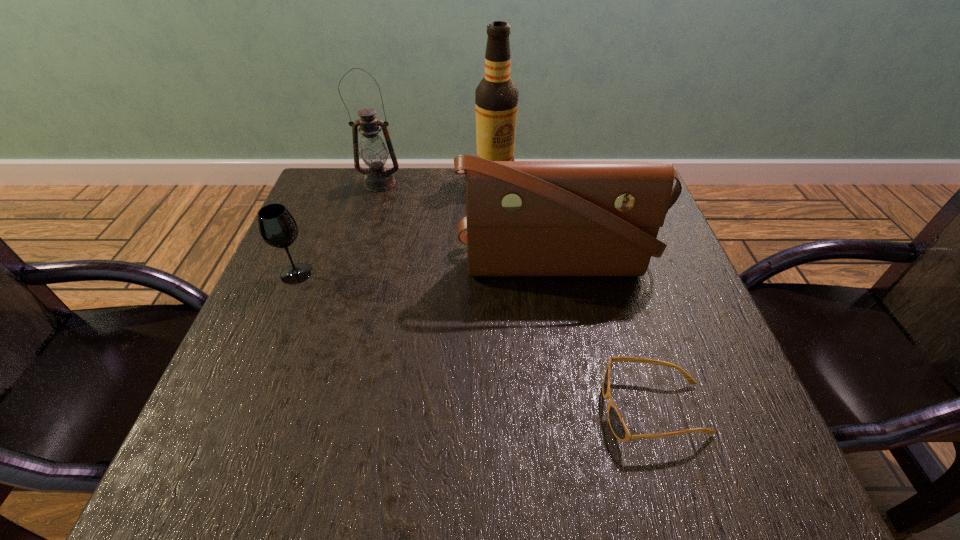
You are a GUI agent. You are given a task and a screenshot of the screen. Output one action in this format:
    pyautogui.click(x=<x>, y=<y>)
    Task: Click on the vacant area that lies between the shortest object and the alcohol
    
    Given the screenshot: What is the action you would take?
    pyautogui.click(x=574, y=293)

Locate an element on the screen. This screenshot has height=540, width=960. blank region between the satchel and the nearest object is located at coordinates (605, 337).

Locate an element on the screen. free spot between the nearest object and the alcohol is located at coordinates (574, 293).

The height and width of the screenshot is (540, 960). Identify the location of blank region between the fourth tallest object and the satchel. (425, 269).

This screenshot has height=540, width=960. What are the coordinates of `empty space between the satchel and the second shortest object` in the screenshot? It's located at (425, 269).

You are a GUI agent. You are given a task and a screenshot of the screen. Output one action in this format:
    pyautogui.click(x=<x>, y=<y>)
    Task: Click on the empty space that is in between the second shortest object and the alcohol
    
    Given the screenshot: What is the action you would take?
    pyautogui.click(x=396, y=226)

I want to click on vacant area that lies between the fourth object from right to left and the alcohol, so click(x=437, y=180).

Locate an element on the screen. vacant space that's between the alcohol and the second object from left to right is located at coordinates (437, 180).

The height and width of the screenshot is (540, 960). In order to click on unoccupied area between the tallest object and the leftmost object in this screenshot , I will do (x=396, y=226).

This screenshot has width=960, height=540. In order to click on object that stands as the third closest to the shortest object in this screenshot , I will do point(277,227).